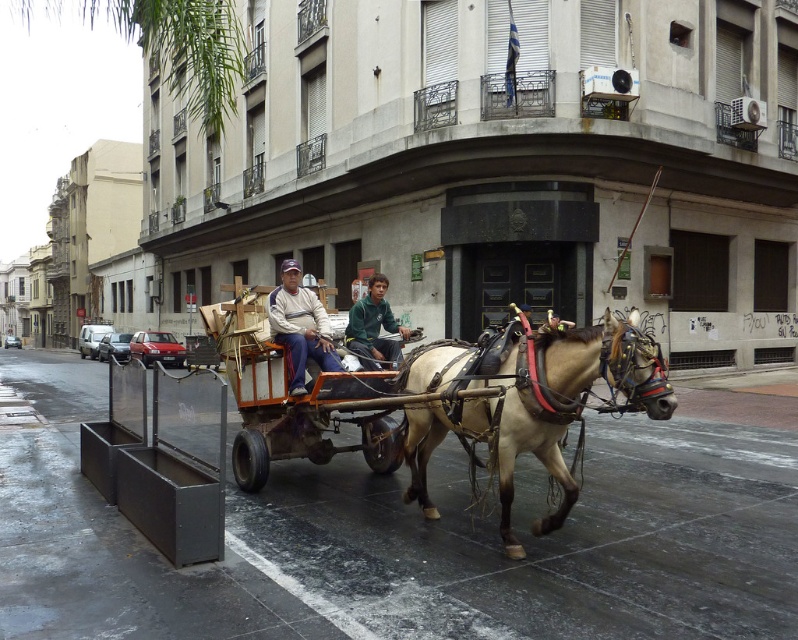
Is light brown leather jacket at center bigger than green fuzzy jacket at center?

Incorrect, light brown leather jacket at center is not larger than green fuzzy jacket at center.

Which is above, light brown leather jacket at center or green fuzzy jacket at center?

light brown leather jacket at center is higher up.

Is point (285, 260) more distant than point (394, 346)?

Yes, point (285, 260) is farther from viewer.

What are the coordinates of `light brown leather jacket at center` in the screenshot? It's located at (299, 326).

Does light brown leather horse at center appear under light brown leather jacket at center?

Indeed, light brown leather horse at center is positioned under light brown leather jacket at center.

Which of these two, light brown leather horse at center or light brown leather jacket at center, stands taller?

light brown leather horse at center

Does point (646, 337) come in front of point (317, 310)?

Yes, it is in front of point (317, 310).

Identify the location of light brown leather horse at center. (540, 408).

Does light brown leather horse at center lie in front of green fuzzy jacket at center?

Yes, light brown leather horse at center is in front of green fuzzy jacket at center.

Between point (425, 404) and point (352, 339), which one is positioned behind?

Point (352, 339)

You are a GUI agent. You are given a task and a screenshot of the screen. Output one action in this format:
    pyautogui.click(x=<x>, y=<y>)
    Task: Click on the light brown leather horse at center
    This screenshot has height=640, width=798.
    Given the screenshot: What is the action you would take?
    pyautogui.click(x=540, y=408)